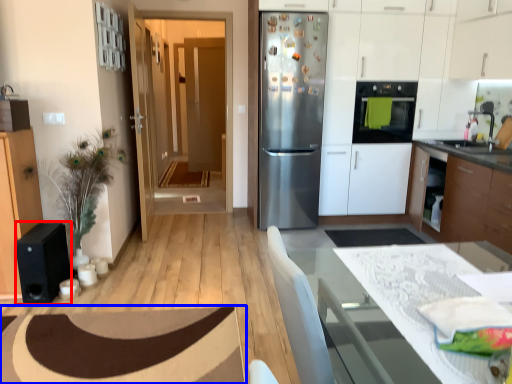
Question: Which of the following is the farthest to the observer, appliance (highlighted by a red box) or plain (highlighted by a blue box)?

Choices:
 (A) appliance
 (B) plain

Answer: (A)